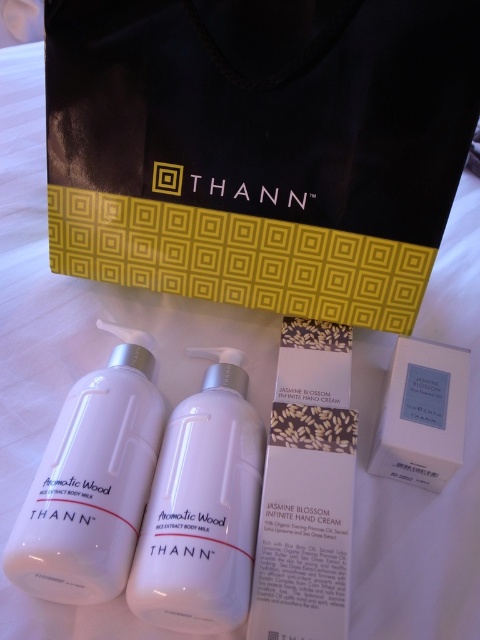
You are organizing a display at a beauty counter and need to place a new THANN product sample between the black matte bag at upper center and the white bottles labeled Aromatic Wood Rice Extract Body Milk. According to the spatial arrangement, where should you position the sample relative to the existing items?

The black matte bag at upper center is located at point (x=260, y=147), so you should place the new sample between the black matte bag at upper center and the white bottles labeled Aromatic Wood Rice Extract Body Milk by positioning it along the line connecting their coordinates, ensuring it is equidistant from both items for optimal spacing.

You are holding a camera at eye level and want to take a photo of the THANN skincare products. The camera can focus on objects within 1 meter. Is the point at coordinate point (x=336, y=264) within the focus range?

The point at coordinate point (x=336, y=264) is 1.22 meters from the camera, which is beyond the camera focus range of 1 meter. Therefore, the camera cannot focus on it.